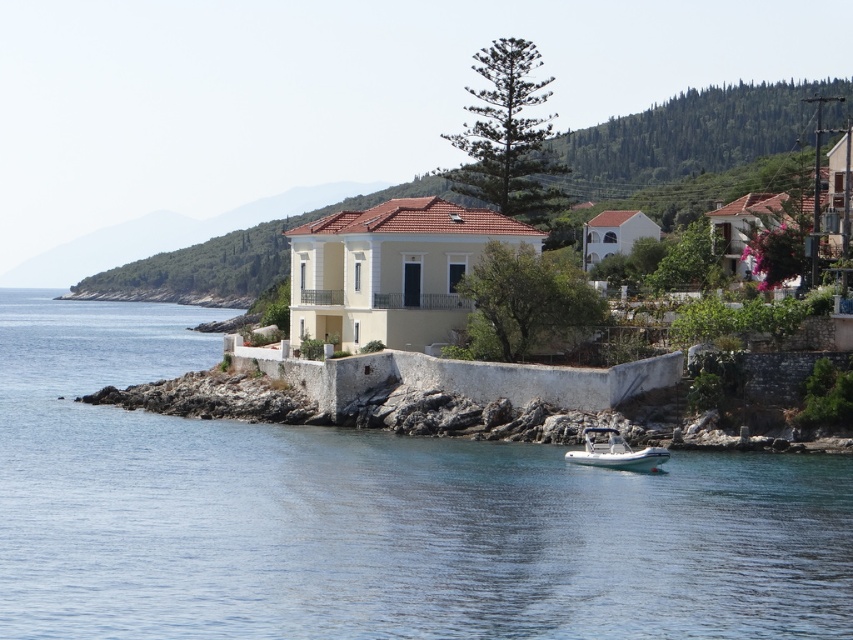
You are planning to launch a small kayak from the shore. The kayak is 2 meters wide. Looking at the image, can you determine if the clear blue water at center has enough space to accommodate the kayak? Please consider the white rubber boat at lower center in your analysis.

The clear blue water at center is wider than the white rubber boat at lower center. Since the kayak is 2 meters wide, and the clear blue water at center has a larger width, it likely has sufficient space to accommodate the kayak.

You are standing on the rocky shore and want to take a photo of the white rubber boat at lower center and the green leafy hillside at upper center. Which object should you focus on first if you want both to be in sharp focus?

You should focus on the green leafy hillside at upper center first because it is closer to you than the white rubber boat at lower center, which is further away. This way, both will be in focus as the hillside is nearer and the boat is behind it.